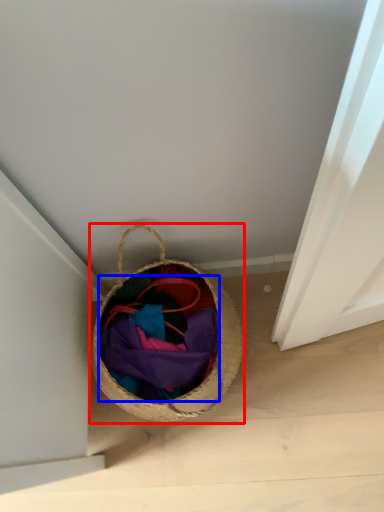
Question: Which point is further to the camera, picnic basket (highlighted by a red box) or clothing (highlighted by a blue box)?

Choices:
 (A) picnic basket
 (B) clothing

Answer: (B)